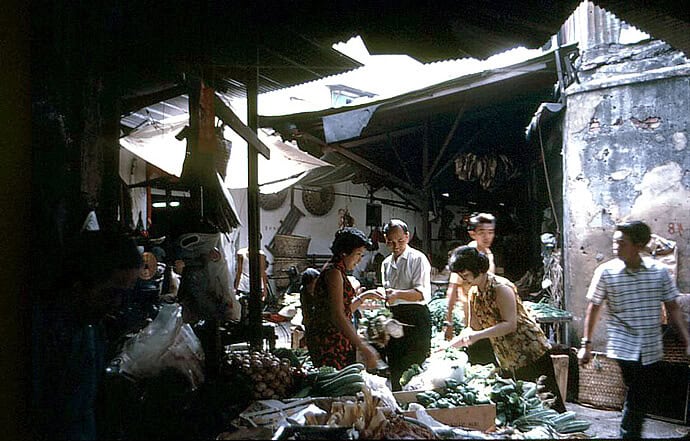
You are a GUI agent. You are given a task and a screenshot of the screen. Output one action in this format:
    pyautogui.click(x=<x>, y=<y>)
    Task: Click on the corrugated ceiling
    The image size is (690, 441).
    Given the screenshot: What is the action you would take?
    pyautogui.click(x=493, y=49)